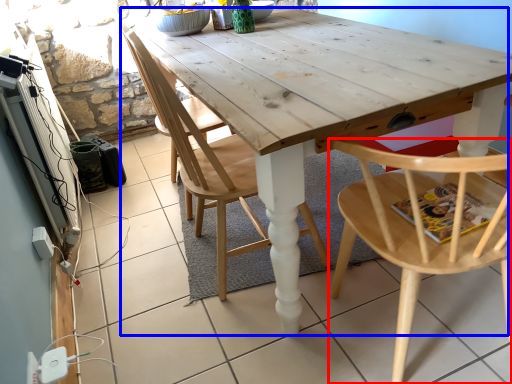
Question: Which object is further to the camera taking this photo, chair (highlighted by a red box) or table (highlighted by a blue box)?

Choices:
 (A) chair
 (B) table

Answer: (B)